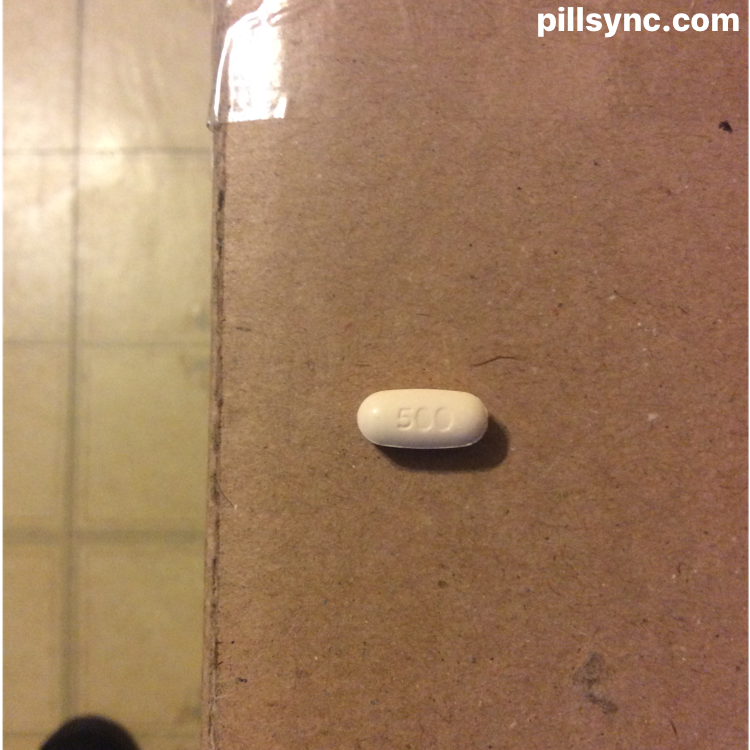
Where is `tile`? tile is located at coordinates (124, 254).